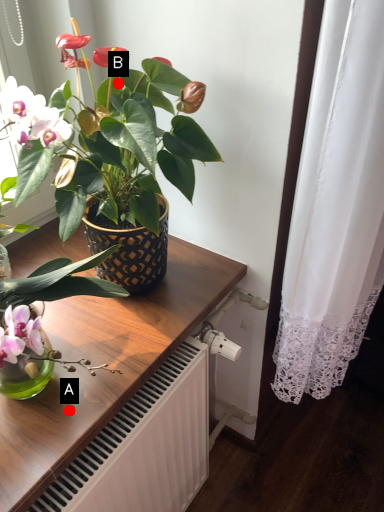
Question: Two points are circled on the image, labeled by A and B beside each circle. Which point is closer to the camera?

Choices:
 (A) A is closer
 (B) B is closer

Answer: (A)